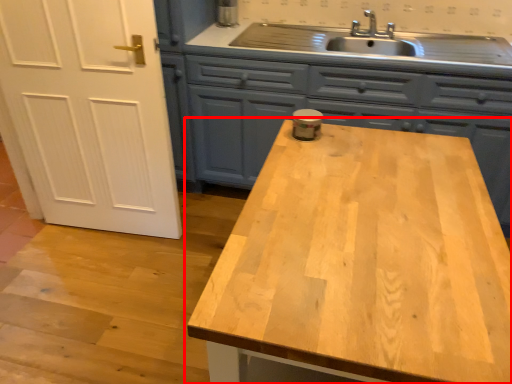
Question: Considering the relative positions of countertop (annotated by the red box) and cabinetry in the image provided, where is countertop (annotated by the red box) located with respect to the staircase?

Choices:
 (A) right
 (B) left

Answer: (B)